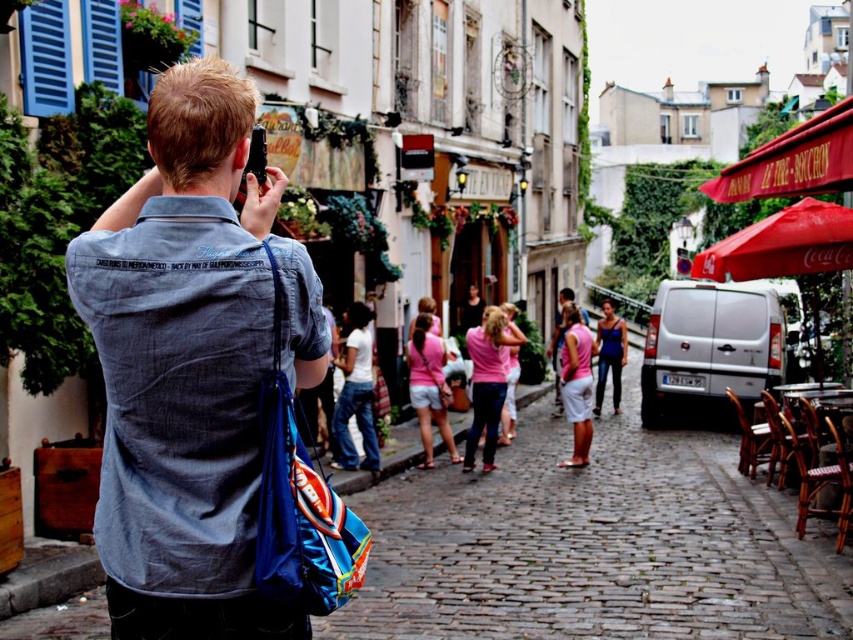
Question: Which point appears closest to the camera in this image?

Choices:
 (A) (741, 525)
 (B) (270, 244)

Answer: (B)

Question: Does denim jacket at upper left appear on the right side of pink fabric dress at center?

Choices:
 (A) no
 (B) yes

Answer: (A)

Question: Which point is farther from the camera taking this photo?

Choices:
 (A) (674, 456)
 (B) (219, 497)

Answer: (A)

Question: Is denim jacket at upper left above pink fabric dress at center?

Choices:
 (A) no
 (B) yes

Answer: (B)

Question: Which of the following is the farthest from the observer?

Choices:
 (A) pink fabric dress at center
 (B) denim jacket at upper left

Answer: (A)

Question: Is denim jacket at upper left closer to the viewer compared to pink fabric dress at center?

Choices:
 (A) no
 (B) yes

Answer: (B)